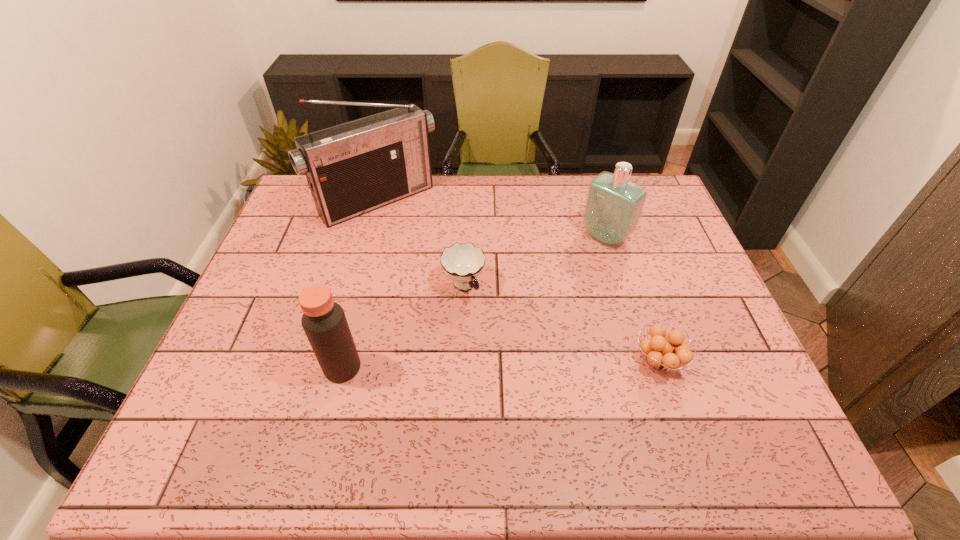
At what (x,y) coordinates should I click in order to perform the action: click on free space that satisfies the following two spatial constraints: 1. on the back side of the vinegar; 2. on the right side of the perfume. Please return your answer as a coordinate pair (x, y). This screenshot has width=960, height=540. Looking at the image, I should click on (375, 237).

This screenshot has width=960, height=540. I want to click on vacant space that satisfies the following two spatial constraints: 1. on the front side of the orange fruit; 2. on the left side of the radio receiver, so tap(335, 361).

You are a GUI agent. You are given a task and a screenshot of the screen. Output one action in this format:
    pyautogui.click(x=<x>, y=<y>)
    Task: Click on the vacant space that satisfies the following two spatial constraints: 1. on the back side of the perfume; 2. on the right side of the vinegar
    
    Given the screenshot: What is the action you would take?
    pyautogui.click(x=375, y=237)

The image size is (960, 540). Identify the location of free space that satisfies the following two spatial constraints: 1. on the front side of the tallest object; 2. on the right side of the vinegar. (333, 368).